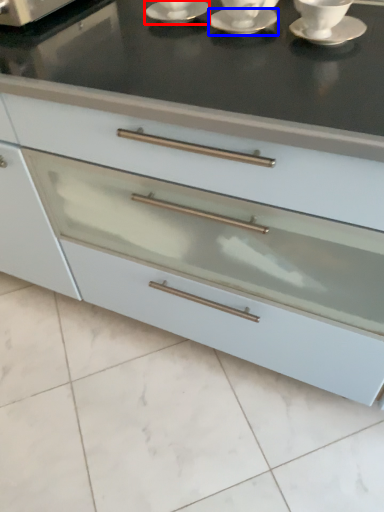
Question: Among these objects, which one is nearest to the camera, saucer (highlighted by a red box) or saucer (highlighted by a blue box)?

Choices:
 (A) saucer
 (B) saucer

Answer: (B)